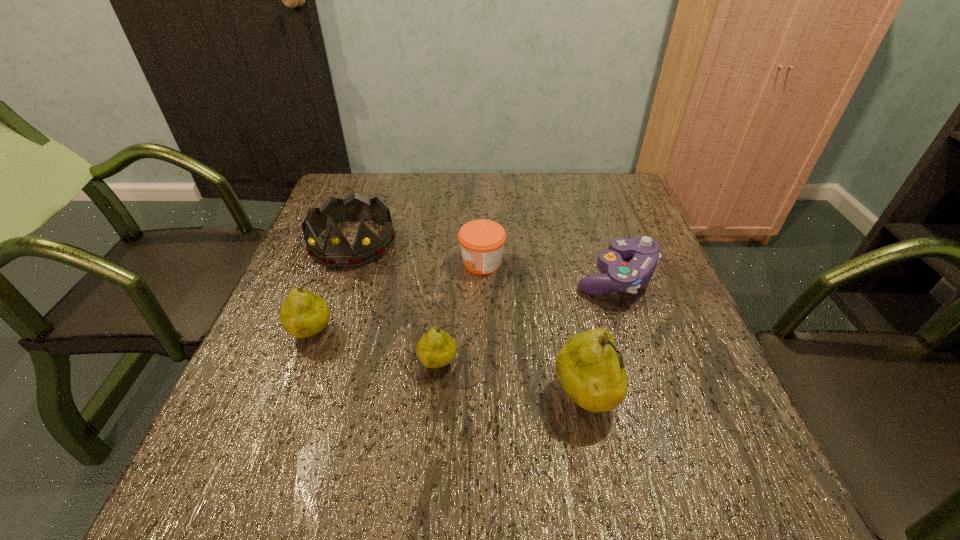
Find the location of `the fourth farthest object`. the fourth farthest object is located at coordinates (304, 313).

I want to click on the leftmost pear, so click(x=304, y=313).

This screenshot has height=540, width=960. In order to click on the shortest pear in this screenshot , I will do `click(435, 349)`.

I want to click on the rightmost pear, so click(590, 369).

At what (x,y) coordinates should I click in order to perform the action: click on the tallest object. Please return your answer as a coordinate pair (x, y). This screenshot has width=960, height=540. Looking at the image, I should click on (590, 369).

Locate an element on the screen. This screenshot has width=960, height=540. control is located at coordinates (643, 252).

Locate an element on the screen. This screenshot has height=540, width=960. jam is located at coordinates (482, 241).

The image size is (960, 540). I want to click on tiara, so click(x=337, y=252).

Identify the location of vacant region located 0.370m on the right of the second tallest pear. This screenshot has width=960, height=540. (515, 334).

Locate an element on the screen. Image resolution: width=960 pixels, height=540 pixels. free space located 0.160m on the back of the second pear from right to left is located at coordinates (445, 295).